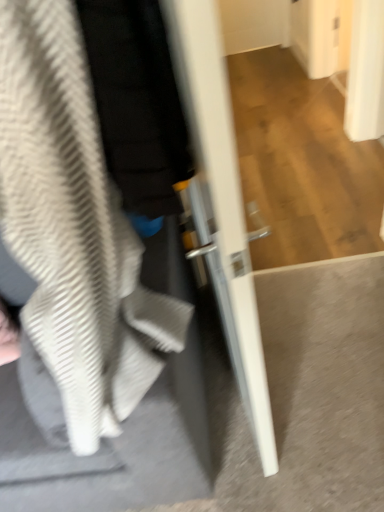
Question: Considering the relative positions of textured gray sweatshirt at left and white glossy door at center in the image provided, is textured gray sweatshirt at left in front of white glossy door at center?

Choices:
 (A) no
 (B) yes

Answer: (A)

Question: Is textured gray sweatshirt at left oriented towards white glossy door at center?

Choices:
 (A) no
 (B) yes

Answer: (A)

Question: Does textured gray sweatshirt at left appear on the left side of white glossy door at center?

Choices:
 (A) yes
 (B) no

Answer: (A)

Question: Can you confirm if textured gray sweatshirt at left is taller than white glossy door at center?

Choices:
 (A) yes
 (B) no

Answer: (B)

Question: Does textured gray sweatshirt at left appear on the right side of white glossy door at center?

Choices:
 (A) yes
 (B) no

Answer: (B)

Question: Does textured gray sweatshirt at left have a lesser height compared to white glossy door at center?

Choices:
 (A) yes
 (B) no

Answer: (A)

Question: From the image's perspective, is white glossy door at center under textured gray sweatshirt at left?

Choices:
 (A) yes
 (B) no

Answer: (B)

Question: Does white glossy door at center have a smaller size compared to textured gray sweatshirt at left?

Choices:
 (A) yes
 (B) no

Answer: (A)

Question: Is white glossy door at center with textured gray sweatshirt at left?

Choices:
 (A) no
 (B) yes

Answer: (A)

Question: Can you confirm if white glossy door at center is thinner than textured gray sweatshirt at left?

Choices:
 (A) no
 (B) yes

Answer: (B)

Question: From a real-world perspective, is white glossy door at center under textured gray sweatshirt at left?

Choices:
 (A) no
 (B) yes

Answer: (A)

Question: Could textured gray sweatshirt at left be considered to be inside white glossy door at center?

Choices:
 (A) no
 (B) yes

Answer: (A)

Question: Considering the positions of point coord(215,158) and point coord(92,253), is point coord(215,158) closer or farther from the camera than point coord(92,253)?

Choices:
 (A) closer
 (B) farther

Answer: (A)